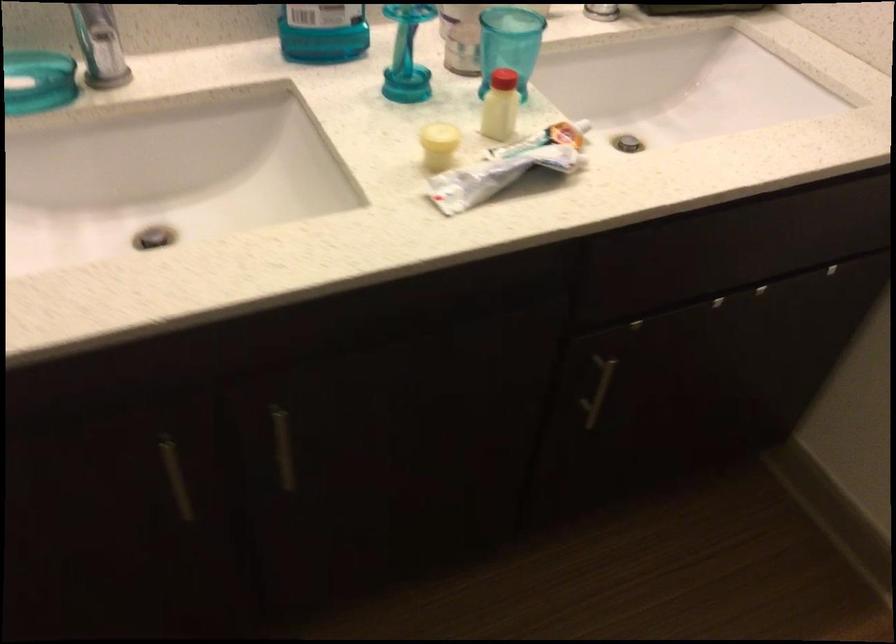
What do you see at coordinates (510, 44) in the screenshot?
I see `the blue plastic cup` at bounding box center [510, 44].